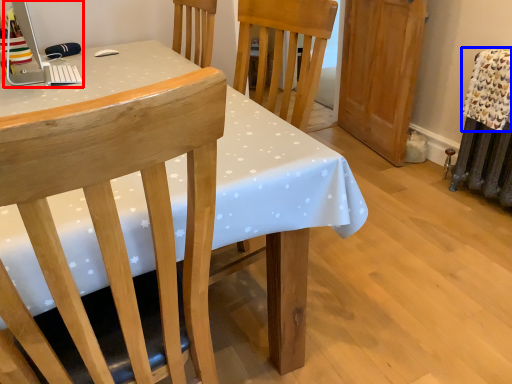
Question: Which point is closer to the camera, desktop computer (highlighted by a red box) or blanket (highlighted by a blue box)?

Choices:
 (A) desktop computer
 (B) blanket

Answer: (A)